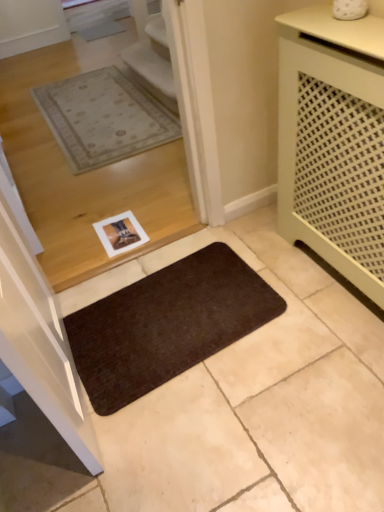
Identify the location of free space in front of brown matte mat at lower center. (201, 434).